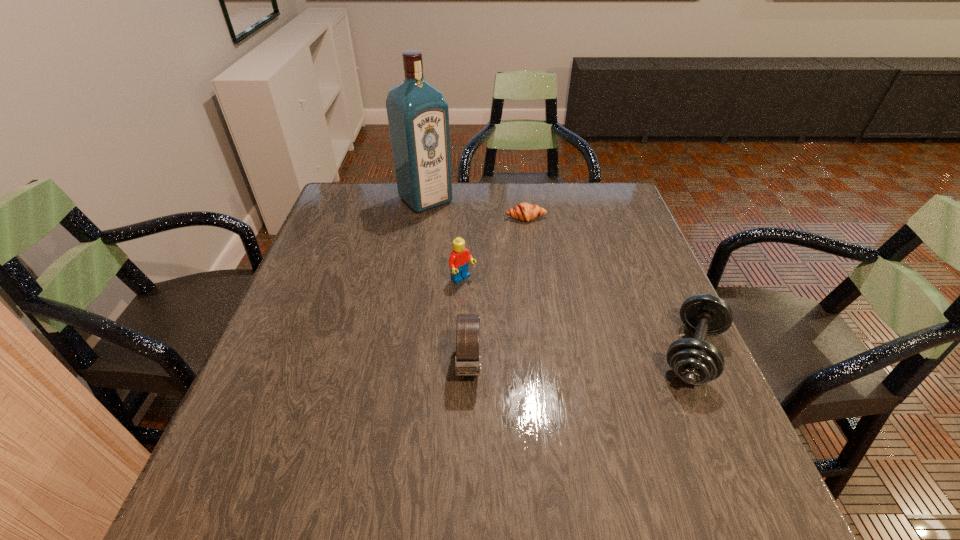
The image size is (960, 540). I want to click on liquor present at the far edge, so click(418, 115).

Identify the location of object at the right edge. This screenshot has width=960, height=540. (695, 361).

Image resolution: width=960 pixels, height=540 pixels. Identify the location of free spot at the far edge of the desktop. (555, 204).

This screenshot has height=540, width=960. Identify the location of vacant space at the left edge of the desktop. (329, 268).

In the image, there is a desktop. At what (x,y) coordinates should I click in order to perform the action: click on vacant space at the right edge. Please return your answer as a coordinate pair (x, y). This screenshot has height=540, width=960. Looking at the image, I should click on (671, 306).

Locate an element on the screen. This screenshot has width=960, height=540. blank space at the far right corner is located at coordinates (608, 200).

Identify the location of empty location between the shortest object and the rightmost object. This screenshot has height=540, width=960. (610, 285).

Identify the location of free spot between the liquor and the pastry. The image size is (960, 540). (476, 208).

I want to click on empty space between the second shortest object and the watch, so click(x=581, y=359).

Image resolution: width=960 pixels, height=540 pixels. Find the location of `vacant area that lies between the third nearest object and the rightmost object`. vacant area that lies between the third nearest object and the rightmost object is located at coordinates (578, 316).